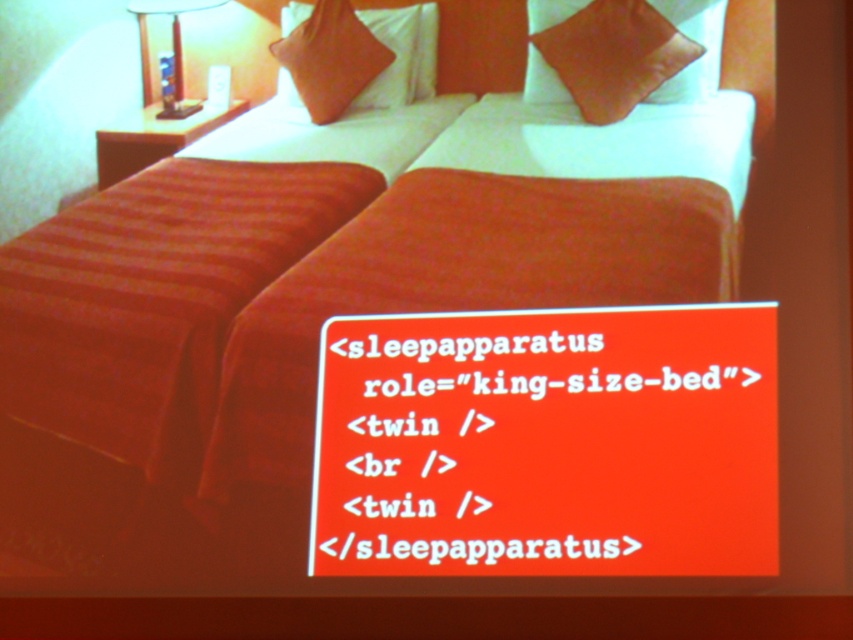
Who is shorter, white text on red background at center or matte white lamp at upper left?

With less height is white text on red background at center.

Between white text on red background at center and matte white lamp at upper left, which one is positioned higher?

matte white lamp at upper left

Where is `white text on red background at center`? The height and width of the screenshot is (640, 853). white text on red background at center is located at coordinates (547, 444).

Identify the location of white text on red background at center. (547, 444).

Does satin orange pillow at upper right appear on the right side of orange fabric pillow at upper center?

Indeed, satin orange pillow at upper right is positioned on the right side of orange fabric pillow at upper center.

Who is more distant from viewer, (x=608, y=115) or (x=357, y=20)?

Positioned behind is point (x=357, y=20).

The height and width of the screenshot is (640, 853). Identify the location of satin orange pillow at upper right. pyautogui.click(x=612, y=54).

Locate an element on the screen. orange fabric pillow at upper center is located at coordinates (370, 70).

Does orange fabric pillow at upper center appear over matte white lamp at upper left?

Actually, orange fabric pillow at upper center is below matte white lamp at upper left.

Find the location of a particular element. orange fabric pillow at upper center is located at coordinates (370, 70).